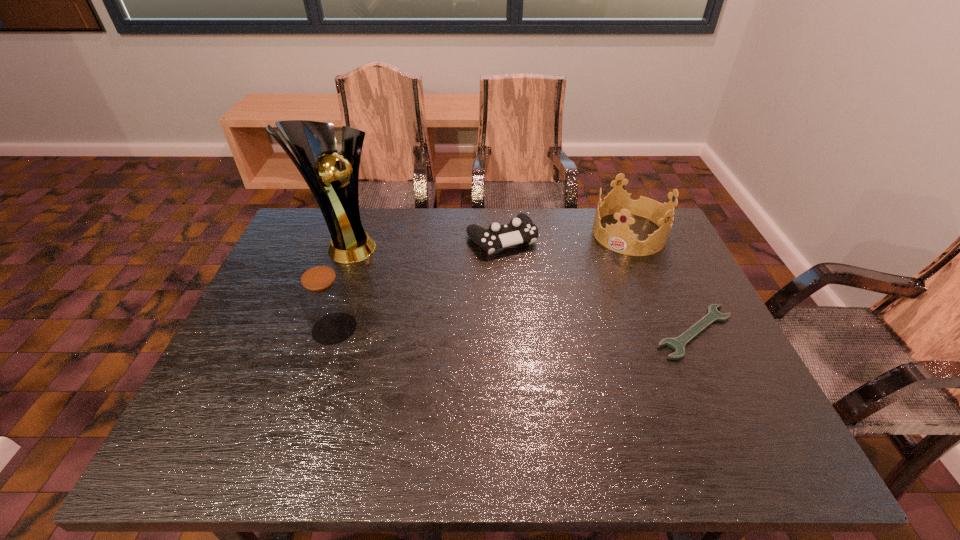
Image resolution: width=960 pixels, height=540 pixels. Identify the location of vacant spot on the desktop that is between the jar and the shortest object and is positioned at the front of the tallest object, where the globe is visible. (481, 330).

I want to click on free space on the desktop that is between the jar and the shortest object and is positioned on the front-facing side of the tiara, so tap(562, 330).

At what (x,y) coordinates should I click in order to perform the action: click on vacant space on the desktop that is between the jar and the shortest object and is positioned on the surface of the control. Please return your answer as a coordinate pair (x, y). The height and width of the screenshot is (540, 960). Looking at the image, I should click on (565, 330).